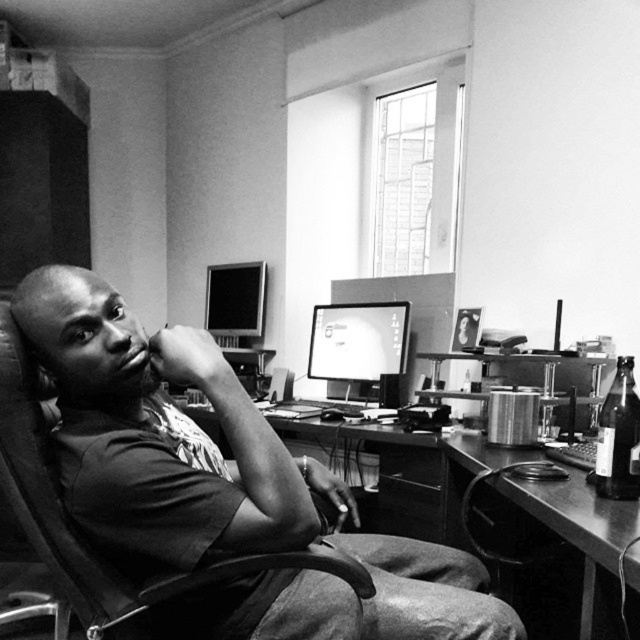
You are standing in the room and want to place a new lamp on the desk. The coordinates given are in the image frame where the origin is the bottom left corner. The desk is at point (x=579, y=525). Where should you place the lamp to ensure it is on the desk?

The coordinates point (x=579, y=525) correspond to the metallic desk at lower right, so placing the lamp at that point will ensure it is on the desk.

You are standing in the room and want to place a small plant between the two points, point [497,460] and point [406,321]. Which point should the plant be closer to if you want it to be nearer to the viewer?

The plant should be placed closer to point [497,460] because it is closer to the viewer than point [406,321].